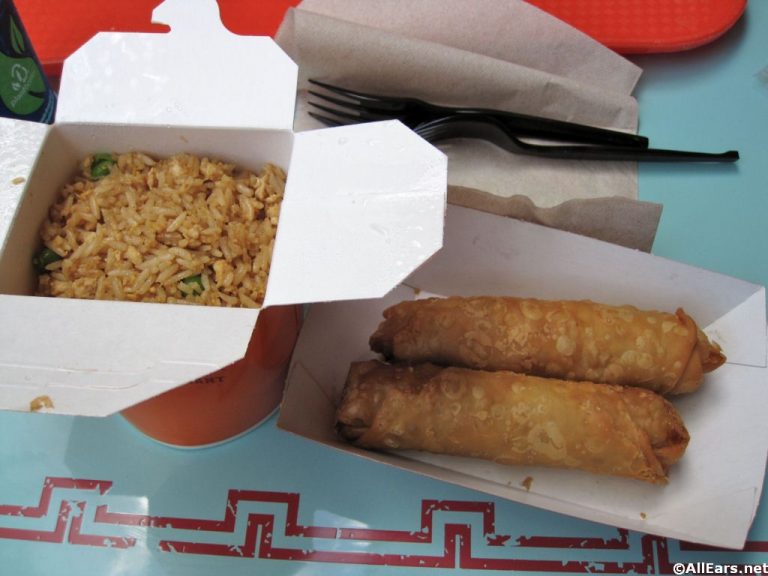
Where is `tiffany blue table top`? This screenshot has width=768, height=576. tiffany blue table top is located at coordinates (300, 463).